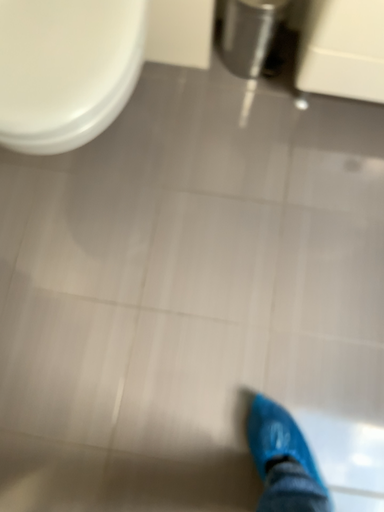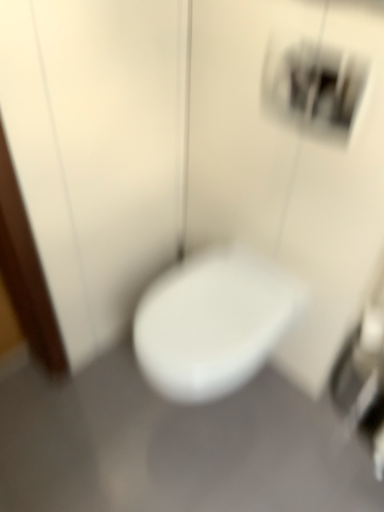
Question: Which way did the camera rotate in the video?

Choices:
 (A) rotated downward
 (B) rotated upward

Answer: (B)